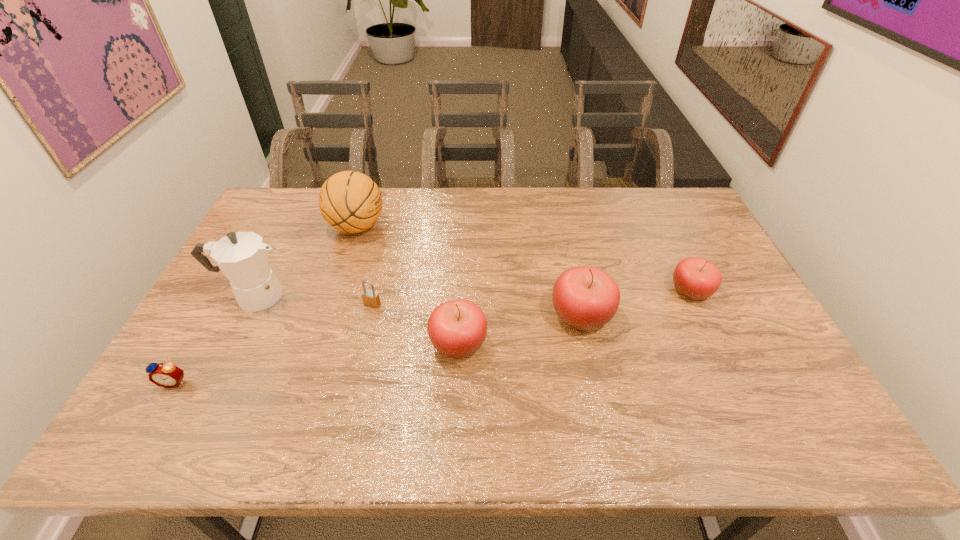
Please point out where to position a new apple on the left to maintain spacing. Please provide its 2D coordinates. Your answer should be formatted as a tuple, i.e. [(x, y)], where the tuple contains the x and y coordinates of a point satisfying the conditions above.

[(320, 376)]